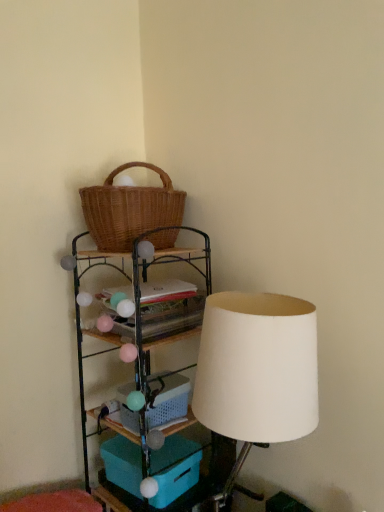
Question: From a real-world perspective, is plastic/mesh basket at lower center physically located above or below woven brown picnic basket at upper left?

Choices:
 (A) below
 (B) above

Answer: (A)

Question: Looking at the image, does plastic/mesh basket at lower center seem bigger or smaller compared to woven brown picnic basket at upper left?

Choices:
 (A) small
 (B) big

Answer: (A)

Question: Based on their relative distances, which object is nearer to the woven wood shelf at upper left?

Choices:
 (A) plastic/mesh basket at lower center
 (B) woven brown picnic basket at upper left
 (C) white matte lampshade at right
 (D) teal plastic storage box at lower center

Answer: (D)

Question: Which object is positioned farthest from the white matte lampshade at right?

Choices:
 (A) plastic/mesh basket at lower center
 (B) woven brown picnic basket at upper left
 (C) woven wood shelf at upper left
 (D) teal plastic storage box at lower center

Answer: (D)